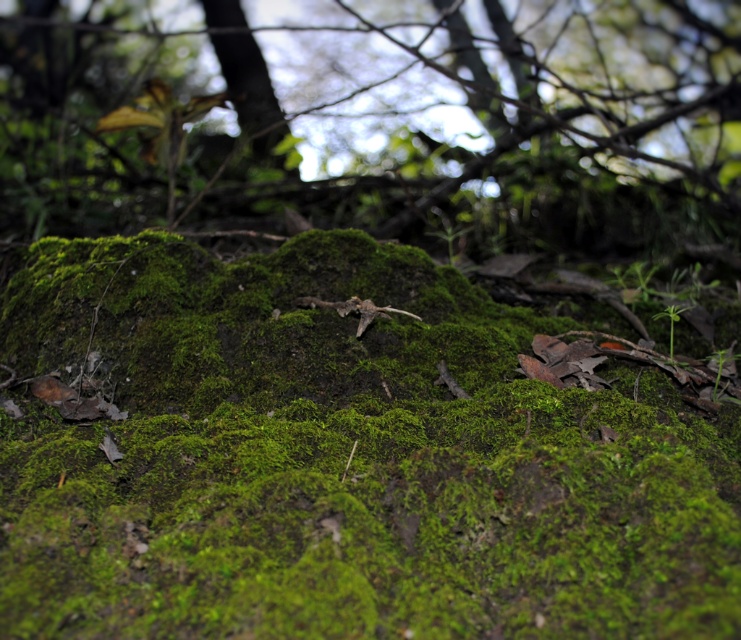
Between point (641, 481) and point (215, 38), which one is positioned in front?

Point (641, 481) is more forward.

Can you confirm if green fuzzy moss at center is positioned to the right of smooth brown tree trunk at upper center?

Yes, green fuzzy moss at center is to the right of smooth brown tree trunk at upper center.

Which is in front, point (418, 461) or point (245, 129)?

Point (418, 461) is in front.

Image resolution: width=741 pixels, height=640 pixels. I want to click on green fuzzy moss at center, so click(x=339, y=460).

Consider the image. Who is taller, green fuzzy moss at center or green mossy rock at center?

Standing taller between the two is green mossy rock at center.

Is green fuzzy moss at center to the right of green mossy rock at center from the viewer's perspective?

Indeed, green fuzzy moss at center is positioned on the right side of green mossy rock at center.

Image resolution: width=741 pixels, height=640 pixels. What do you see at coordinates (339, 460) in the screenshot?
I see `green fuzzy moss at center` at bounding box center [339, 460].

Locate an element on the screen. The width and height of the screenshot is (741, 640). green fuzzy moss at center is located at coordinates (339, 460).

Between point (734, 84) and point (255, 74), which one is positioned in front?

Point (734, 84) is in front.

Measure the distance between green mossy rock at center and smooth brown tree trunk at upper center.

green mossy rock at center is 28.23 inches from smooth brown tree trunk at upper center.

Is point (36, 129) closer to viewer compared to point (256, 88)?

Yes.

Locate an element on the screen. The image size is (741, 640). green mossy rock at center is located at coordinates (379, 120).